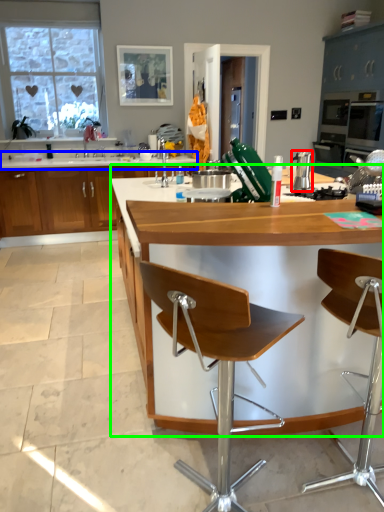
Question: Based on their relative distances, which object is nearer to appliance (highlighted by a red box)? Choose from countertop (highlighted by a blue box) and countertop (highlighted by a green box).

Choices:
 (A) countertop
 (B) countertop

Answer: (B)